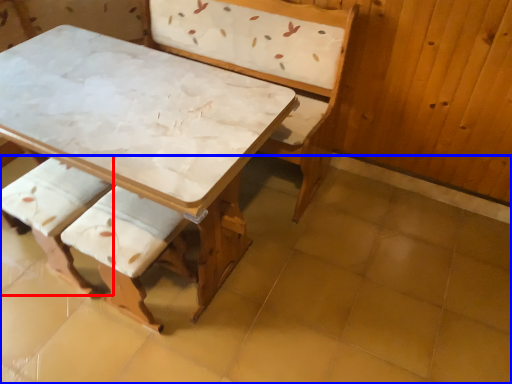
Question: Which object appears closest to the camera in this image, armchair (highlighted by a red box) or tile (highlighted by a blue box)?

Choices:
 (A) armchair
 (B) tile

Answer: (B)